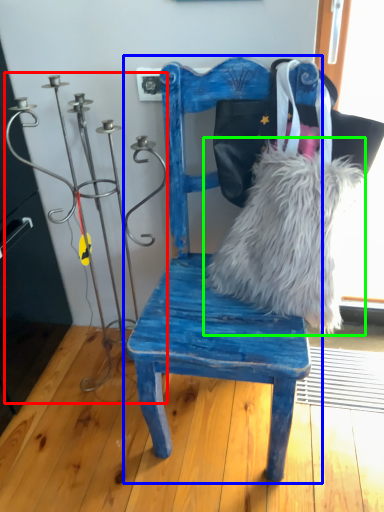
Question: Considering the real-world distances, which object is farthest from candle holder (highlighted by a red box)? chair (highlighted by a blue box) or fur (highlighted by a green box)?

Choices:
 (A) chair
 (B) fur

Answer: (B)